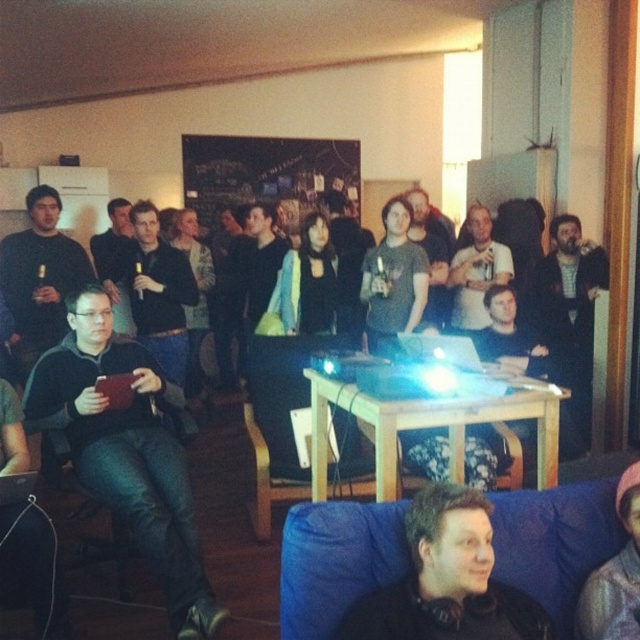
You are organizing a small event and need to place a decorative item on the table. The pink fuzzy hat at lower right and the black leather chair at lower left are in the room. Which object is positioned higher relative to the other?

The pink fuzzy hat at lower right is located above the black leather chair at lower left, so it is positioned higher.